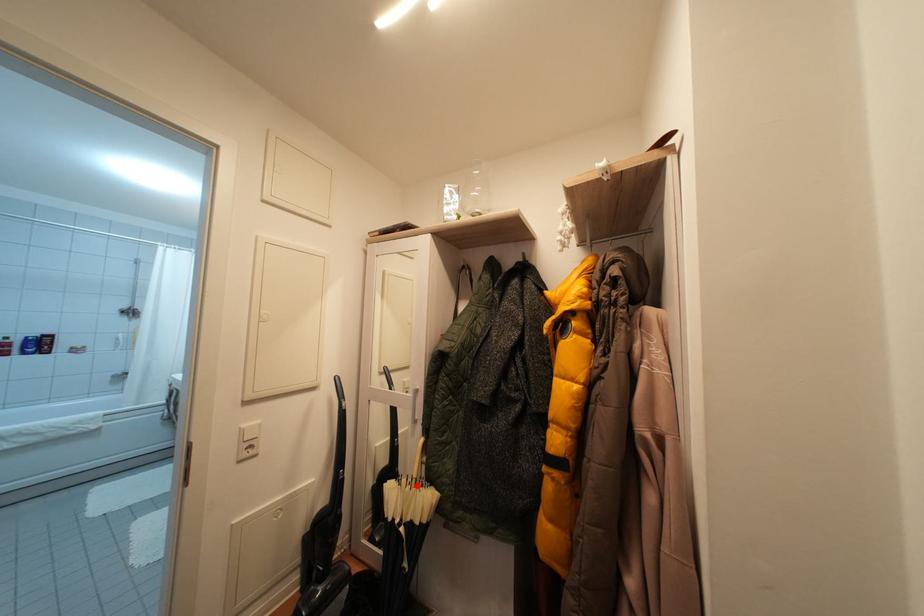
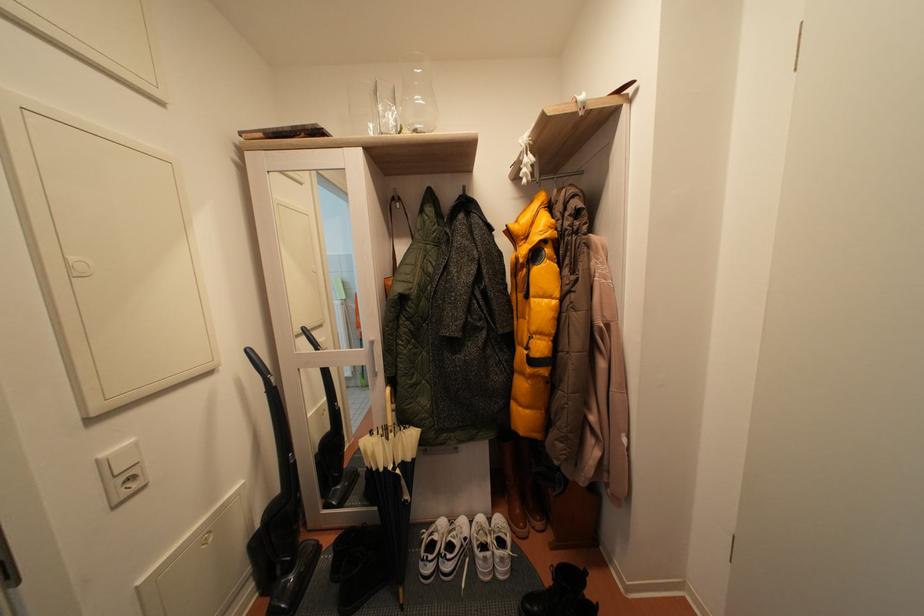
Locate, in the second image, the point that corresponds to the highlighted location in the first image.

(387, 437)